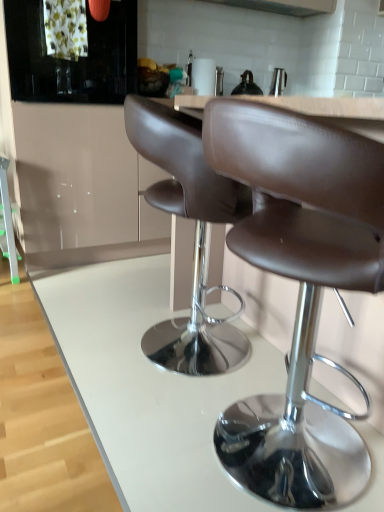
Question: Based on their positions, is white glossy counter at center located to the left or right of brown leather stool at center?

Choices:
 (A) right
 (B) left

Answer: (B)

Question: Is white glossy counter at center spatially inside brown leather stool at center, or outside of it?

Choices:
 (A) inside
 (B) outside

Answer: (B)

Question: Which of these objects is positioned farthest from the satin silver exhaust hood at upper center?

Choices:
 (A) black glass cabinet at upper left, marked as the second cabinetry in a bottom-to-top arrangement
 (B) glossy white cabinet at upper left, the first cabinetry in the bottom-to-top sequence
 (C) white glossy counter at center
 (D) brown leather stool at center
 (E) green plastic ladder at left

Answer: (D)

Question: Which of these objects is positioned closest to the glossy white cabinet at upper left, the first cabinetry in the bottom-to-top sequence?

Choices:
 (A) satin silver exhaust hood at upper center
 (B) green plastic ladder at left
 (C) black glass cabinet at upper left, the 1th cabinetry from the top
 (D) white glossy counter at center
 (E) brown leather stool at center

Answer: (C)